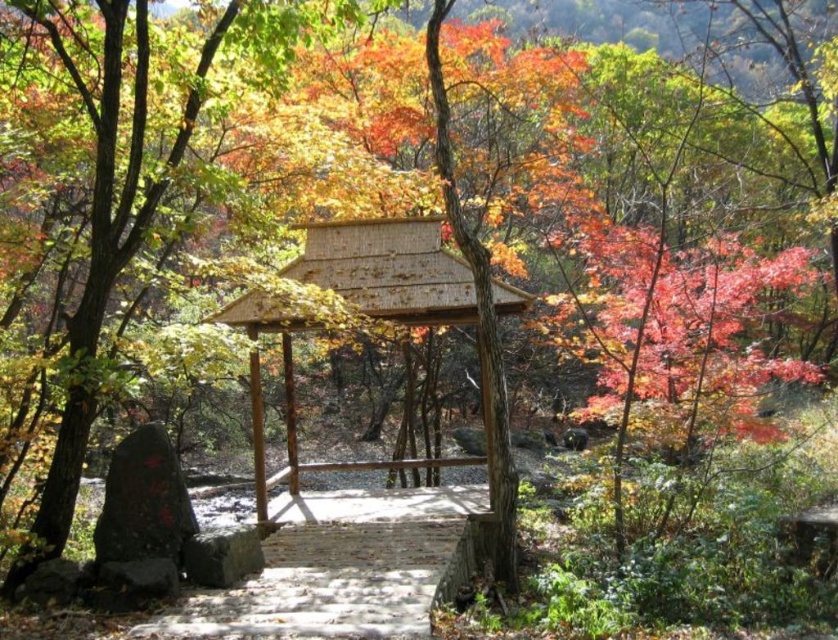
You are a tourist standing at the entrance of the forest path. You see the white stone path at center and the wooden gazebo at center. Which object is positioned to the left of the other?

The white stone path at center is to the left of wooden gazebo at center.